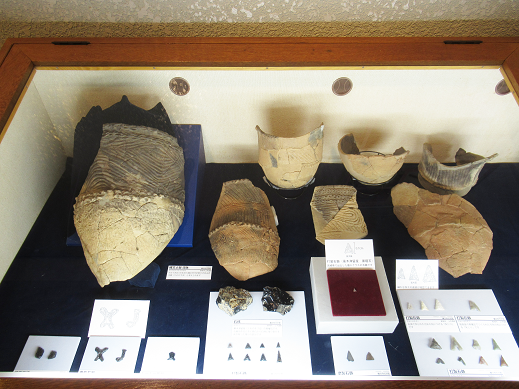
Locate an element on the screen. This screenshot has width=519, height=389. ventilation holes in back of case is located at coordinates (177, 84), (342, 84), (502, 87).